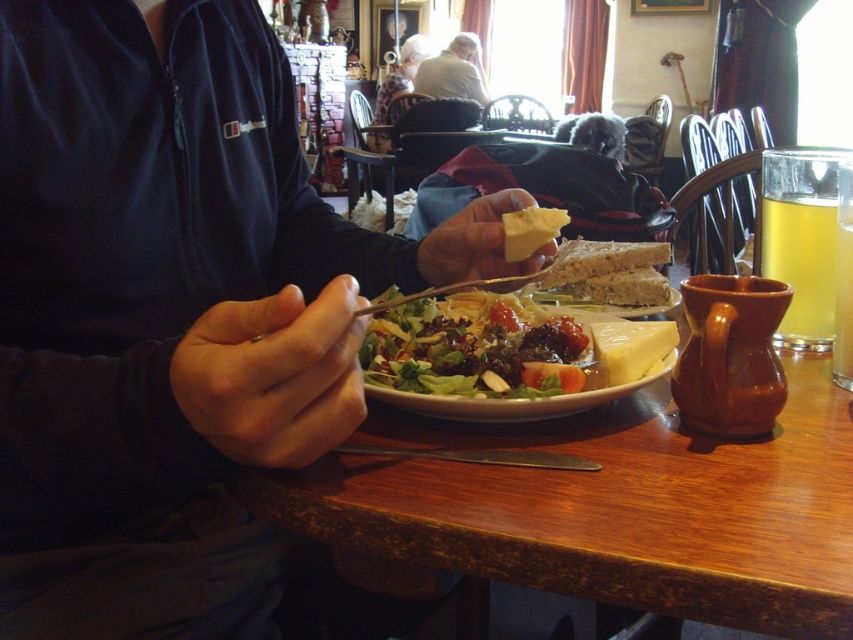
You are a waiter in a restaurant and need to place a new dish on the table. The table has the matte black jacket at center and the yellow creamy cheese at plate center. Where should you place the dish so it doesn t interfere with the existing items?

The matte black jacket at center is located above the yellow creamy cheese at plate center, so the dish should be placed below the yellow creamy cheese at plate center to avoid interference.